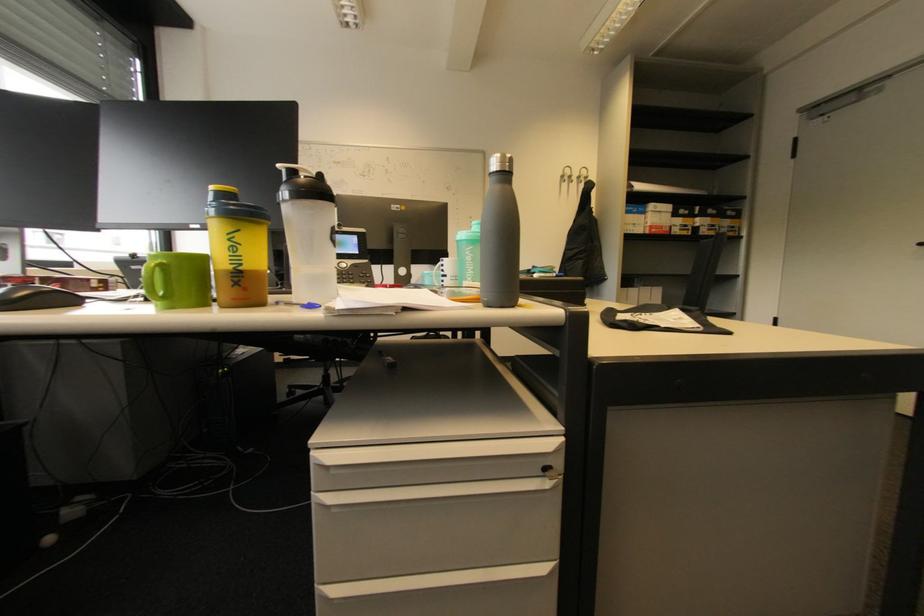
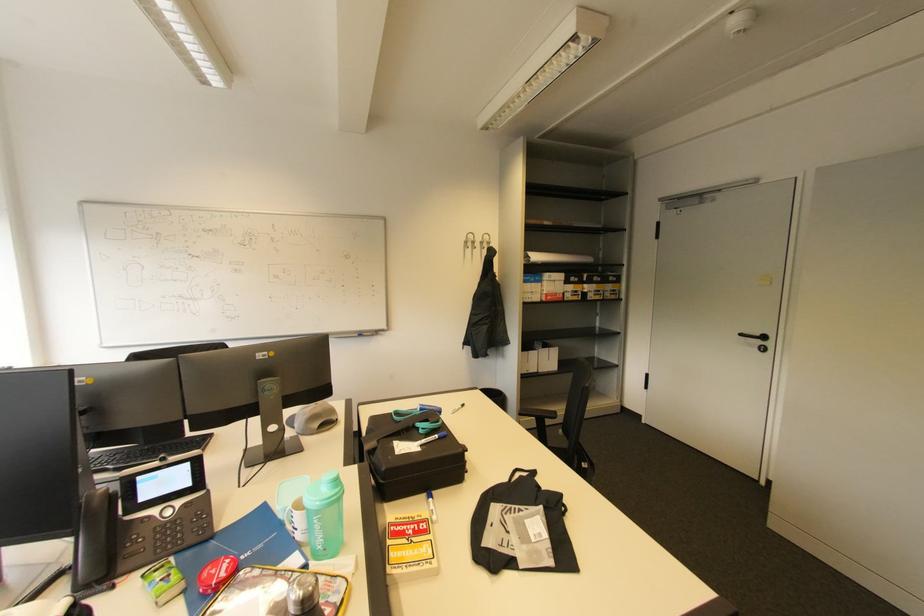
Locate, in the second image, the point that corresponds to pixel 640 282 in the first image.

(541, 342)